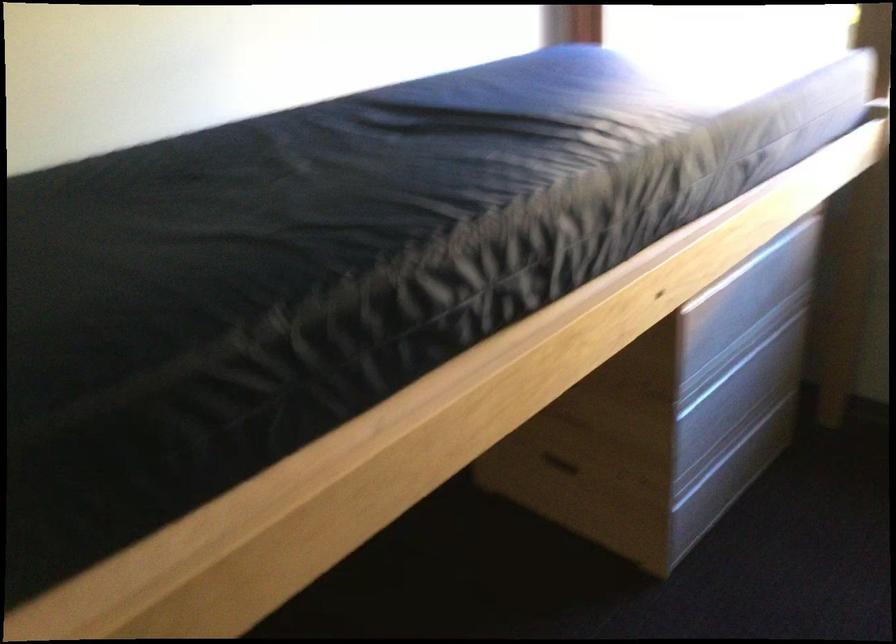
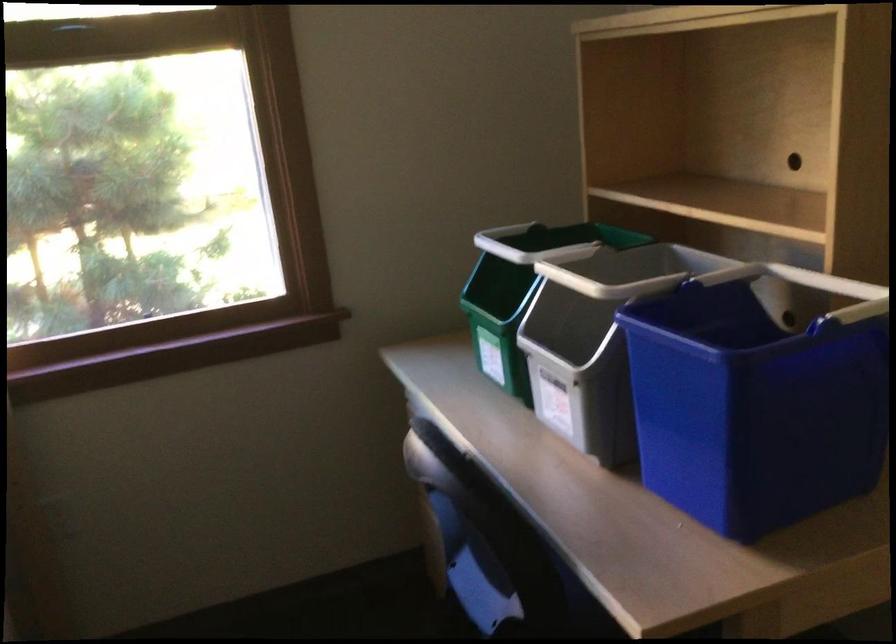
Question: The camera is either moving clockwise (left) or counter-clockwise (right) around the object. The first image is from the beginning of the video and the second image is from the end. Is the camera moving left or right when shooting the video?

Choices:
 (A) Left
 (B) Right

Answer: (A)